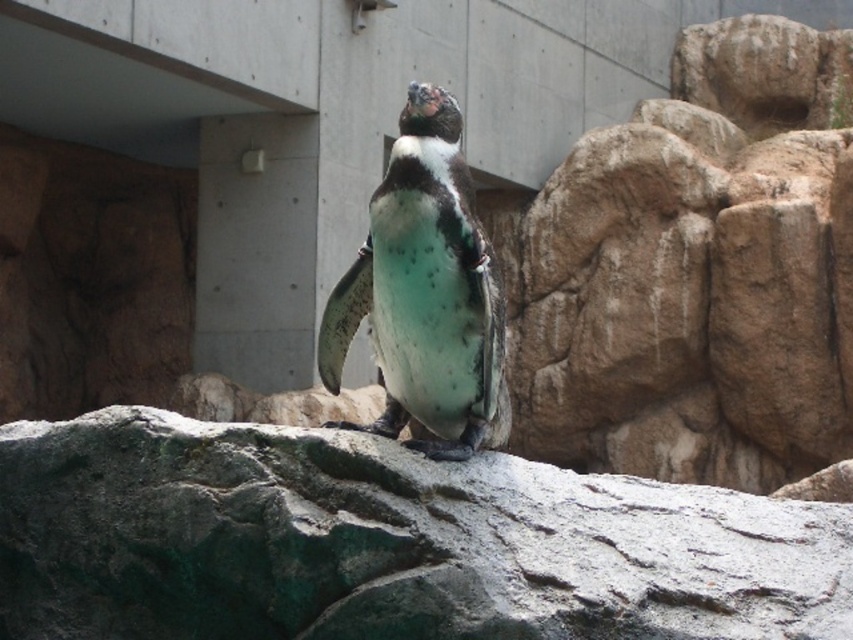
In the scene shown: You are standing in front of the penguin enclosure and want to take a photo of the penguin at point (102, 448). If your camera can focus on objects within 3 meters, will it be able to capture the penguin clearly?

The distance of point (102, 448) from the camera is 3.44 meters. Since the camera can focus within 3 meters, it will not be able to capture the penguin clearly at that distance.

You are a photographer taking a picture of the penguin in the enclosure. You notice two points in the image labeled as point 1 at coordinates point 1 at coordinates point (831, 509) and point 2 at coordinates point (465, 417). Which point is closer to your camera?

Point (465, 417) is closer to the camera because the description states that point (831, 509) is further away than point (465, 417).

You are standing in front of the penguin enclosure and want to take a photo of the penguin. The camera you have can focus on objects up to 15 meters away. Is the point at coordinate point (711, 32) within the camera focus range?

The point at coordinate point (711, 32) is 12.32 meters from the viewer, which is within the camera focus range of up to 15 meters. Therefore, the camera can focus on that point.